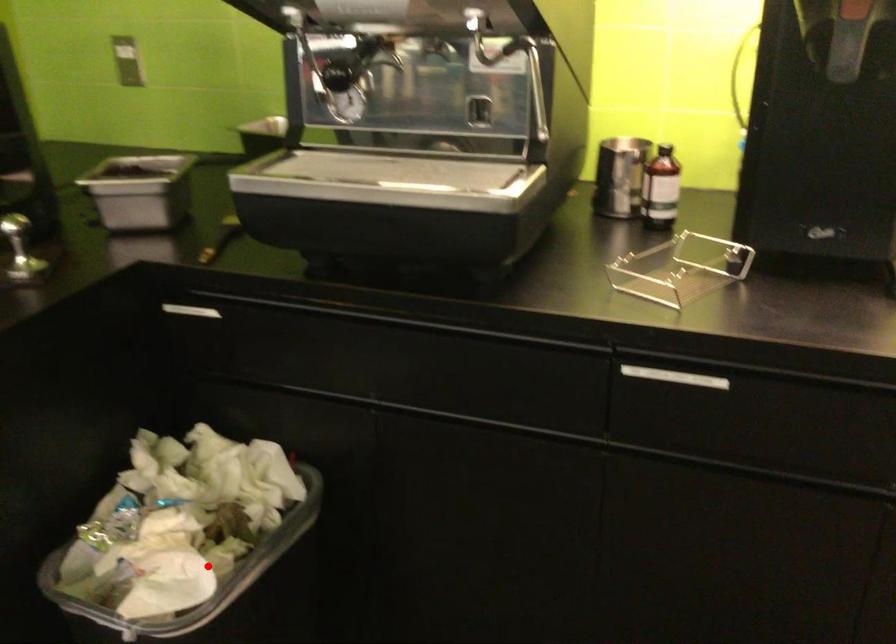
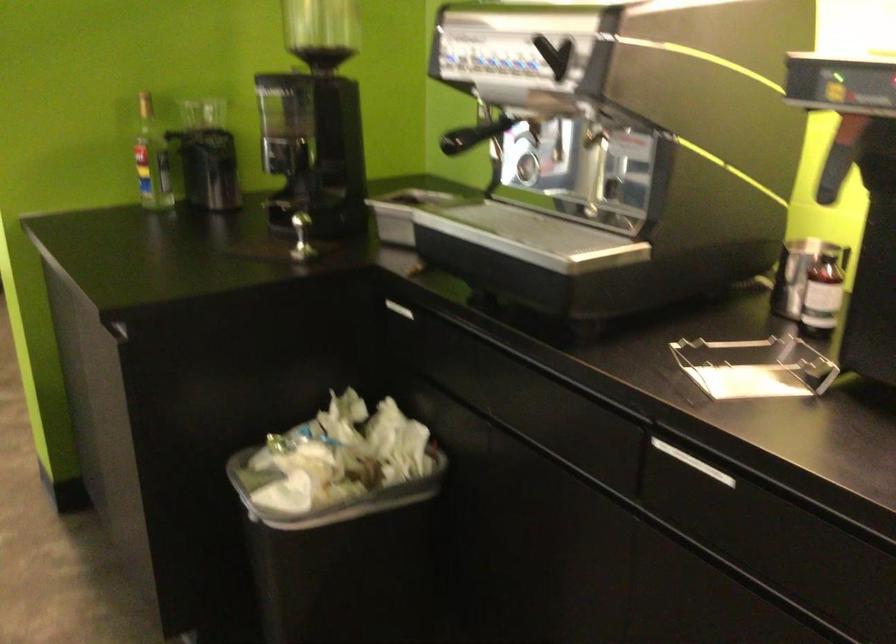
The point at the highlighted location is marked in the first image. Where is the corresponding point in the second image?

(328, 495)